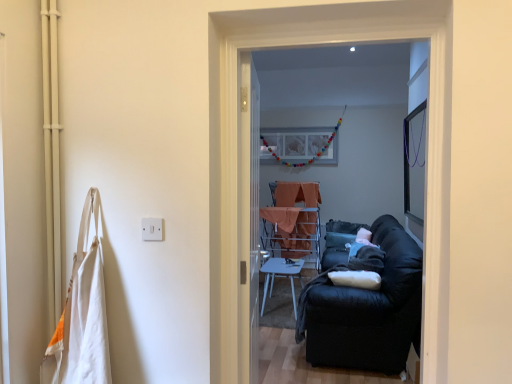
Question: Is clear glass screen door at center, acting as the second screen door starting from the front, inside or outside of white glossy table at center?

Choices:
 (A) outside
 (B) inside

Answer: (A)

Question: Is point pos(246,66) positioned closer to the camera than point pos(279,259)?

Choices:
 (A) closer
 (B) farther

Answer: (A)

Question: Considering the real-world distances, which object is closest to the black fabric couch at right?

Choices:
 (A) black fabric screen door at center, acting as the first screen door starting from the front
 (B) matte white picture frame at center
 (C) white glossy table at center
 (D) orange fabric-covered table at center
 (E) clear glass screen door at center, acting as the second screen door starting from the front

Answer: (C)

Question: Estimate the real-world distances between objects in this image. Which object is closer to the black fabric couch at right?

Choices:
 (A) white cotton bag at left
 (B) orange fabric-covered table at center
 (C) black fabric screen door at center, acting as the second screen door starting from the back
 (D) matte white picture frame at center
 (E) clear glass screen door at center, the first screen door from the back

Answer: (E)